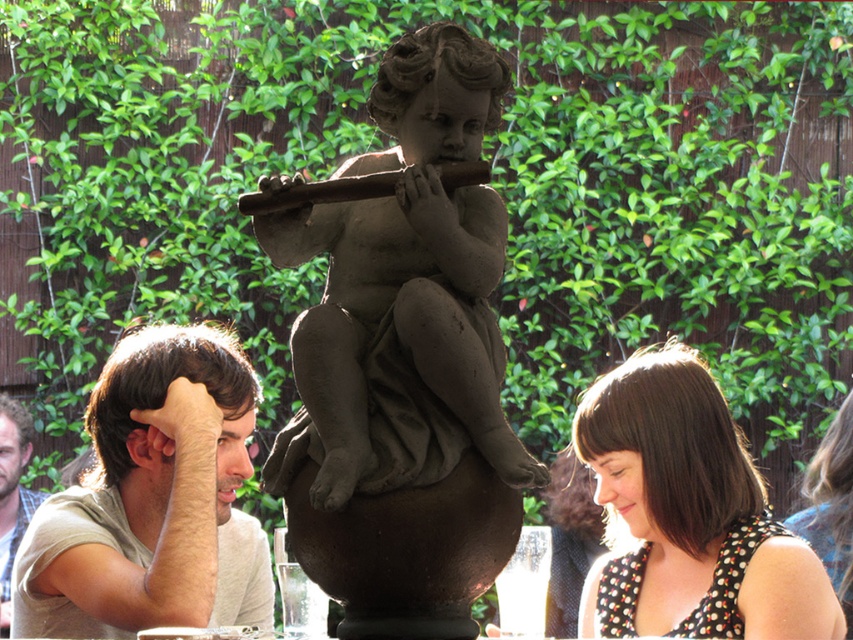
Question: Is light brown hair at left further to the viewer compared to brown hair man at left?

Choices:
 (A) yes
 (B) no

Answer: (B)

Question: Can you confirm if polka dot blouse at lower right is bigger than brown hair man at left?

Choices:
 (A) no
 (B) yes

Answer: (B)

Question: Which point appears closest to the camera in this image?

Choices:
 (A) (137, 472)
 (B) (32, 493)
 (C) (498, 227)
 (D) (630, 602)

Answer: (C)

Question: Based on their relative distances, which object is nearer to the polka dot fabric dress at lower right?

Choices:
 (A) matte gray statue at center
 (B) polka dot blouse at lower right

Answer: (A)

Question: Considering the real-world distances, which object is closest to the polka dot fabric dress at lower right?

Choices:
 (A) polka dot blouse at lower right
 (B) matte gray statue at center
 (C) brown hair man at left

Answer: (B)

Question: Does light brown hair at left appear on the left side of polka dot fabric dress at lower right?

Choices:
 (A) no
 (B) yes

Answer: (B)